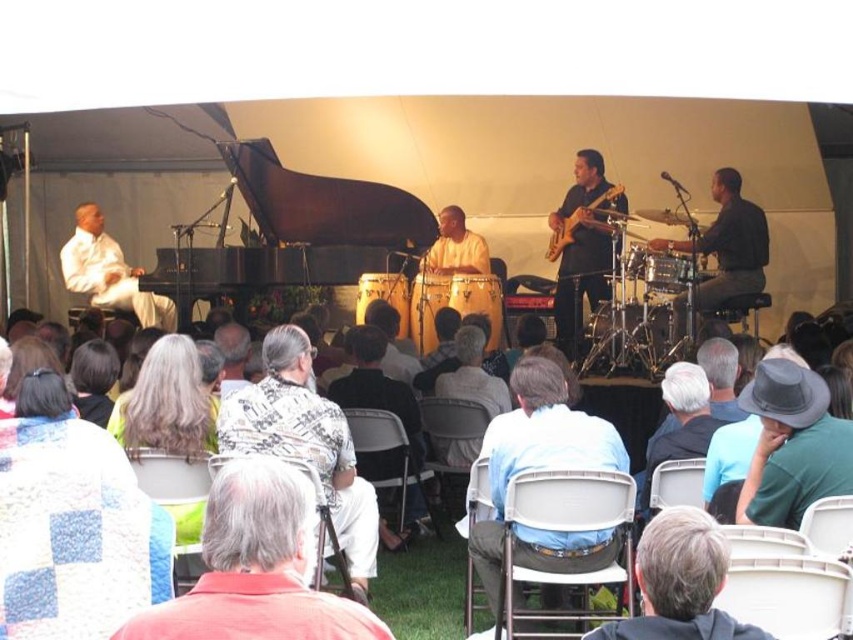
You are a GUI agent. You are given a task and a screenshot of the screen. Output one action in this format:
    pyautogui.click(x=<x>, y=<y>)
    Task: Click on the flannel shirt at center
    The width and height of the screenshot is (853, 640).
    Given the screenshot: What is the action you would take?
    pyautogui.click(x=254, y=570)

In the scene shown: Who is lower down, flannel shirt at center or light blue shirt at center?

flannel shirt at center

What do you see at coordinates (254, 570) in the screenshot? I see `flannel shirt at center` at bounding box center [254, 570].

The width and height of the screenshot is (853, 640). What are the coordinates of `flannel shirt at center` in the screenshot? It's located at (254, 570).

Is gray fabric hat at upper center to the left of smooth wooden drum at center from the viewer's perspective?

No, gray fabric hat at upper center is not to the left of smooth wooden drum at center.

Is gray fabric hat at upper center thinner than smooth wooden drum at center?

Indeed, gray fabric hat at upper center has a lesser width compared to smooth wooden drum at center.

Is point (689, 582) positioned behind point (440, 259)?

No, (689, 582) is in front of (440, 259).

Locate an element on the screen. The width and height of the screenshot is (853, 640). gray fabric hat at upper center is located at coordinates (679, 582).

Is light blue shirt at center smaller than white fabric chairs at center?

Incorrect, light blue shirt at center is not smaller in size than white fabric chairs at center.

Based on the photo, is light blue shirt at center closer to the viewer compared to white fabric chairs at center?

Yes, light blue shirt at center is in front of white fabric chairs at center.

Where is `light blue shirt at center`? light blue shirt at center is located at coordinates (538, 456).

Locate an element on the screen. light blue shirt at center is located at coordinates (538, 456).